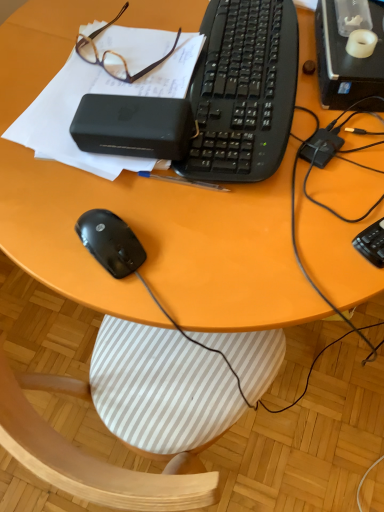
Where is `vacant space in between black plastic keyboard at center, acting as the 1th computer keyboard starting from the left, and black plastic desktop computer at upper right`? This screenshot has width=384, height=512. vacant space in between black plastic keyboard at center, acting as the 1th computer keyboard starting from the left, and black plastic desktop computer at upper right is located at coordinates (324, 122).